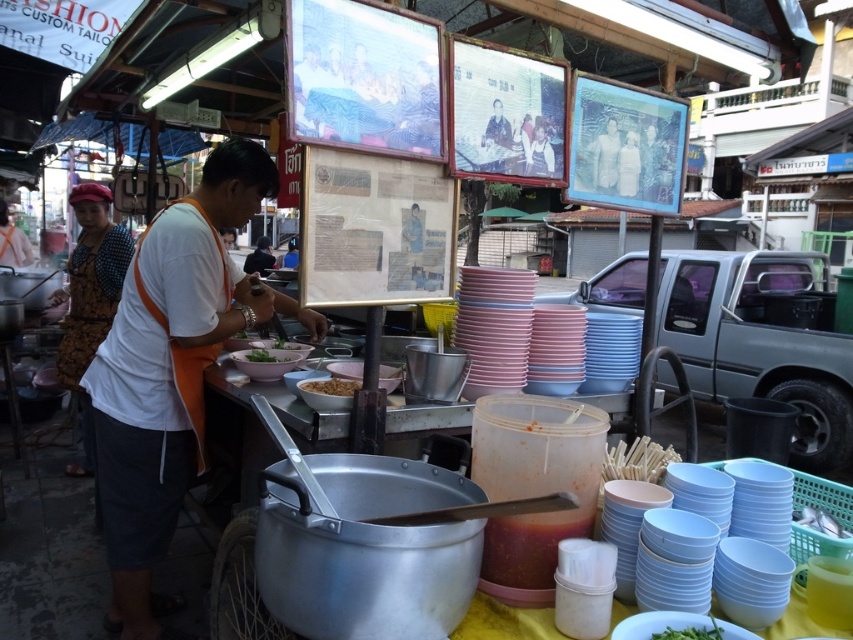
Does patterned fabric headscarf at left have a lesser height compared to brown matte food at center?

No, patterned fabric headscarf at left is not shorter than brown matte food at center.

Does patterned fabric headscarf at left appear over brown matte food at center?

Indeed, patterned fabric headscarf at left is positioned over brown matte food at center.

Identify the location of patterned fabric headscarf at left. (90, 298).

Which is more to the left, green leafy vegetable at center or white matte bowl at center?

From the viewer's perspective, green leafy vegetable at center appears more on the left side.

Is green leafy vegetable at center wider than white matte bowl at center?

Correct, the width of green leafy vegetable at center exceeds that of white matte bowl at center.

You are a GUI agent. You are given a task and a screenshot of the screen. Output one action in this format:
    pyautogui.click(x=<x>, y=<y>)
    Task: Click on the green leafy vegetable at center
    The width and height of the screenshot is (853, 640).
    Given the screenshot: What is the action you would take?
    pyautogui.click(x=270, y=355)

Is brown matte food at center below green leafy vegetable at center?

Yes.

Which is below, brown matte food at center or green leafy vegetable at center?

Positioned lower is brown matte food at center.

Is point (322, 385) in front of point (254, 353)?

Yes.

This screenshot has width=853, height=640. Identify the location of brown matte food at center. (329, 387).